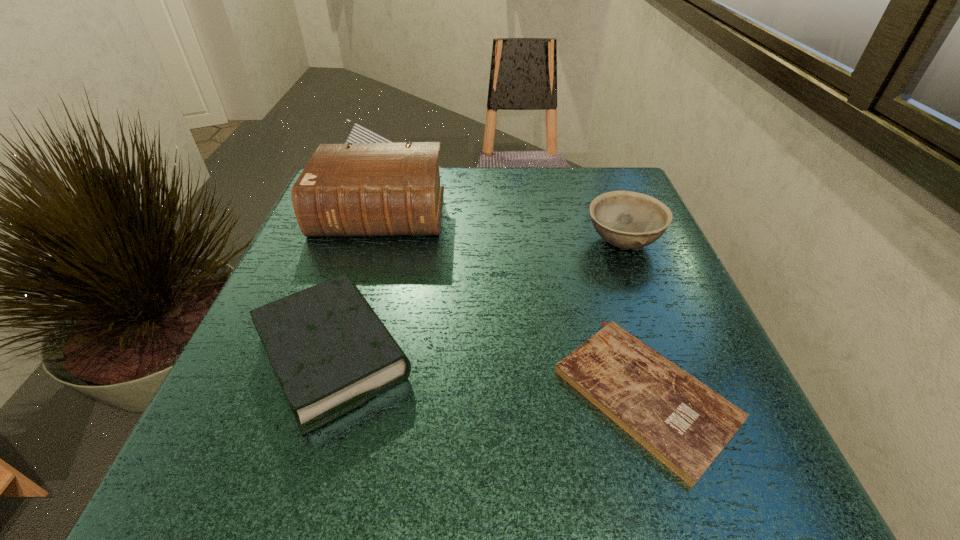
Locate an element on the screen. The height and width of the screenshot is (540, 960). free area in between the farthest Bible and the second tallest object is located at coordinates (501, 227).

Where is `object that is the third closest one to the bowl`? object that is the third closest one to the bowl is located at coordinates (331, 353).

Locate which object is the closest to the second tallest object. Please provide its 2D coordinates. Your answer should be formatted as a tuple, i.e. [(x, y)], where the tuple contains the x and y coordinates of a point satisfying the conditions above.

[(685, 424)]

Find the location of a particular element. The height and width of the screenshot is (540, 960). Bible object that ranks as the third closest to the second tallest object is located at coordinates (331, 353).

Locate an element on the screen. Bible that can be found as the third closest to the bowl is located at coordinates (331, 353).

Where is `vacant space that satisfies the following two spatial constraints: 1. on the back side of the bowl; 2. on the right side of the third tallest object`? vacant space that satisfies the following two spatial constraints: 1. on the back side of the bowl; 2. on the right side of the third tallest object is located at coordinates (369, 242).

Locate an element on the screen. free space that satisfies the following two spatial constraints: 1. on the spine side of the tallest object; 2. on the right side of the bowl is located at coordinates (372, 242).

I want to click on blank space that satisfies the following two spatial constraints: 1. on the spine side of the third shortest object; 2. on the right side of the farthest Bible, so click(x=372, y=242).

The width and height of the screenshot is (960, 540). In order to click on vacant region that satisfies the following two spatial constraints: 1. on the spine side of the second tallest object; 2. on the left side of the tallest object in this screenshot , I will do `click(372, 242)`.

Where is `free spot that satisfies the following two spatial constraints: 1. on the back side of the second tallest Bible; 2. on the right side of the bowl`? Image resolution: width=960 pixels, height=540 pixels. free spot that satisfies the following two spatial constraints: 1. on the back side of the second tallest Bible; 2. on the right side of the bowl is located at coordinates (369, 242).